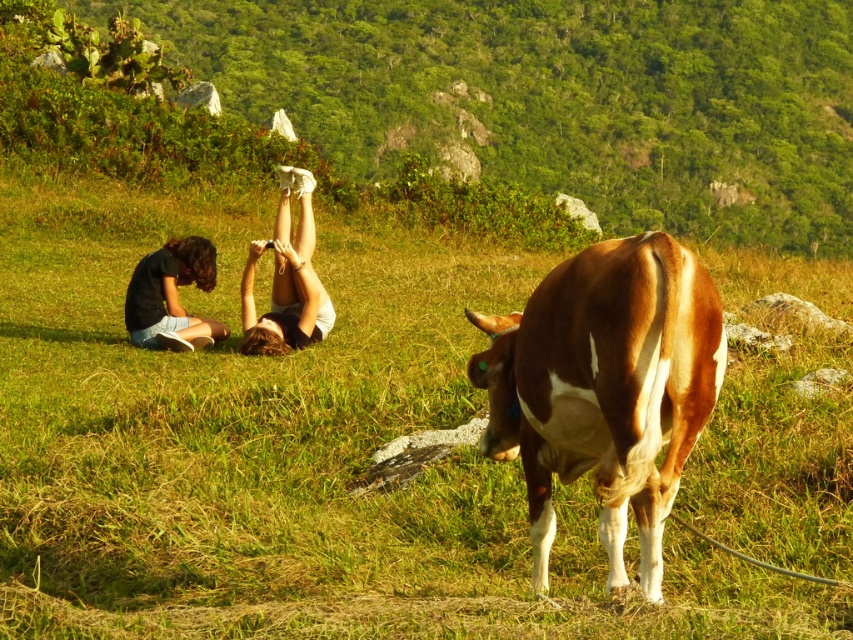
You are standing at the origin point of this coordinate system. You want to move towards the matte black shorts at lower left. Which direction should you move in the horizontal and vertical axes?

The matte black shorts at lower left is located at coordinate point 0.464 on the horizontal axis and 0.202 on the vertical axis. Since you are at the origin point, you should move towards the positive direction on both the horizontal and vertical axes to reach it.

You are standing in the grassy field and see the point at coordinates (171, 296). What object is located at that point?

The point at coordinates (171, 296) corresponds to the matte black shorts at lower left.

You are standing 1.5 meters away from the camera. You want to take a photo of the brown and white cow at center. Can you reach the camera to take the photo?

The distance between the brown and white cow at center and the camera is 3.44 meters. Since you are 1.5 meters away from the camera, you are within reach to operate it and take the photo.